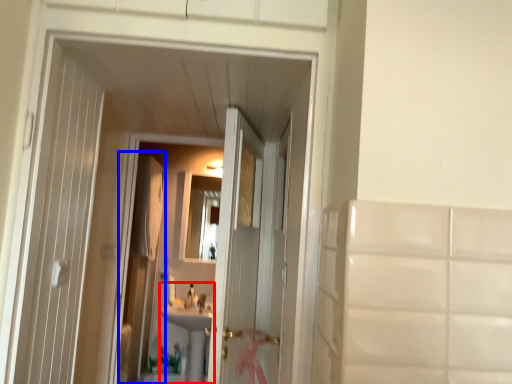
Question: Which object is closer to the camera taking this photo, sink (highlighted by a red box) or screen door (highlighted by a blue box)?

Choices:
 (A) sink
 (B) screen door

Answer: (B)